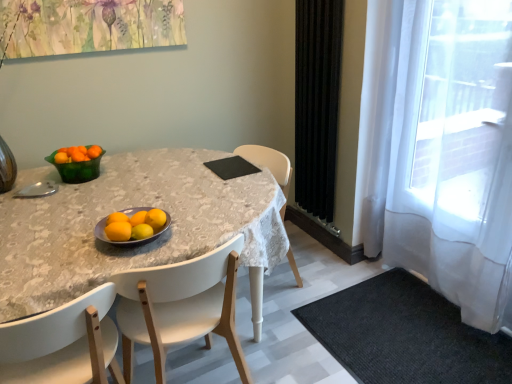
At what (x,y) coordinates should I click in order to perform the action: click on free spot behind black matte pad at center. Please return your answer as a coordinate pair (x, y). This screenshot has height=384, width=512. Looking at the image, I should click on (244, 152).